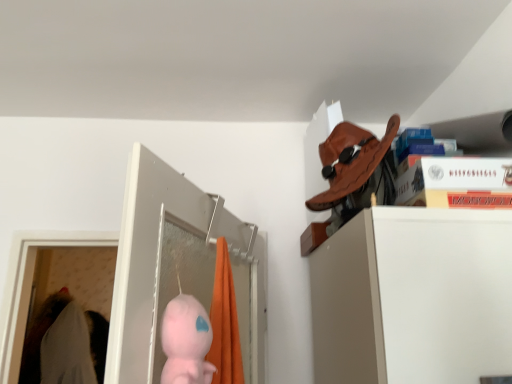
Describe the element at coordinates (186, 342) in the screenshot. I see `pink plush toy at lower center` at that location.

Identify the location of pink plush toy at lower center. The width and height of the screenshot is (512, 384). (186, 342).

At what (x,y) coordinates should I click in order to perform the action: click on pink plush toy at lower center. Please return your answer as a coordinate pair (x, y). The image size is (512, 384). Looking at the image, I should click on (186, 342).